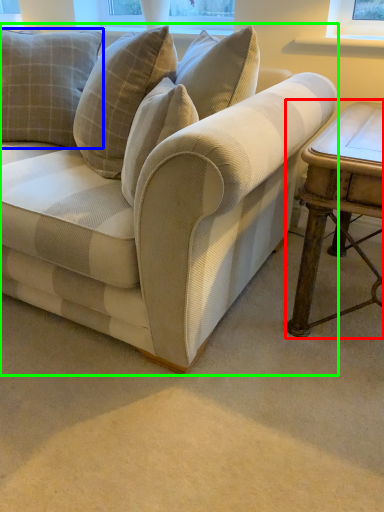
Question: Which is nearer to the table (highlighted by a red box)? pillow (highlighted by a blue box) or studio couch (highlighted by a green box).

Choices:
 (A) pillow
 (B) studio couch

Answer: (B)